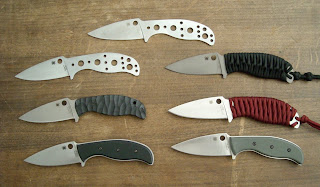
In order to click on cord in this screenshot , I will do (x=255, y=61).